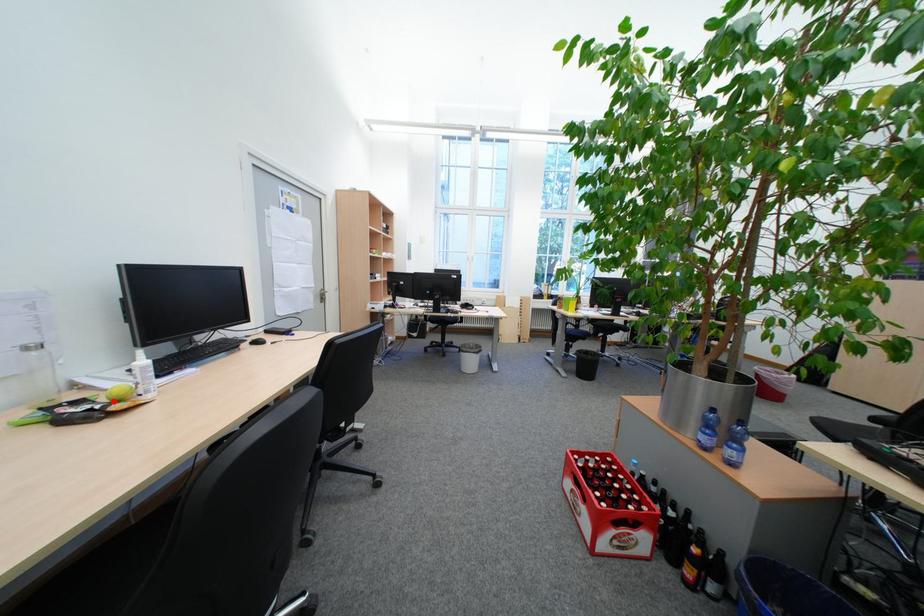
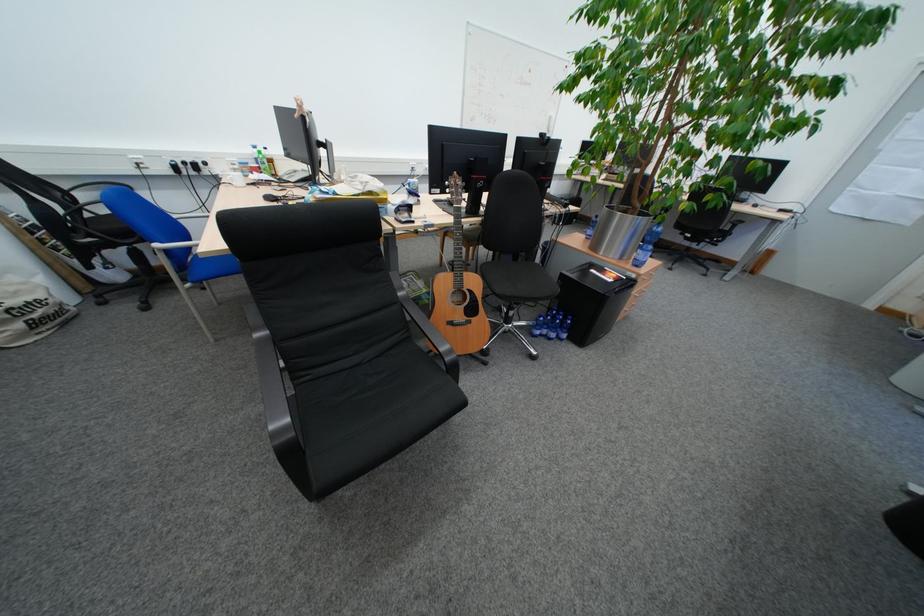
Question: I am providing you with two images of the same scene from different viewpoints. A red point is marked on the first image. Is the red point's position out of view in image 2?

Choices:
 (A) Yes
 (B) No

Answer: (A)